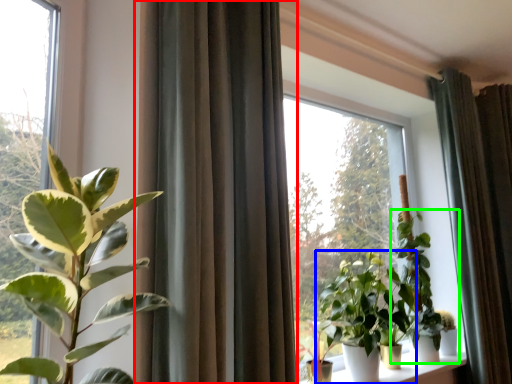
Question: Which object is the farthest from curtain (highlighted by a red box)? Choose among these: houseplant (highlighted by a blue box) or houseplant (highlighted by a green box).

Choices:
 (A) houseplant
 (B) houseplant

Answer: (B)